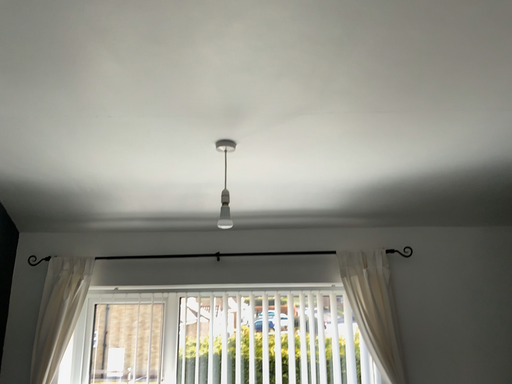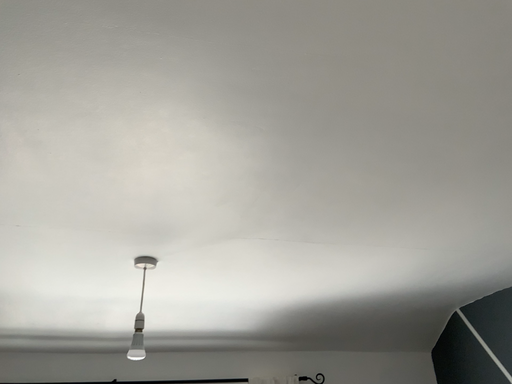
Question: Which way did the camera rotate in the video?

Choices:
 (A) rotated left
 (B) rotated right

Answer: (B)